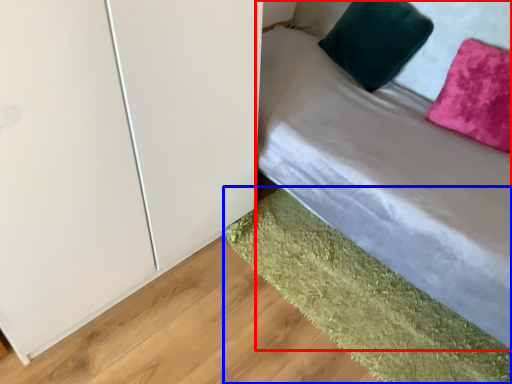
Question: Which point is closer to the camera, bed (highlighted by a red box) or mat (highlighted by a blue box)?

Choices:
 (A) bed
 (B) mat

Answer: (A)